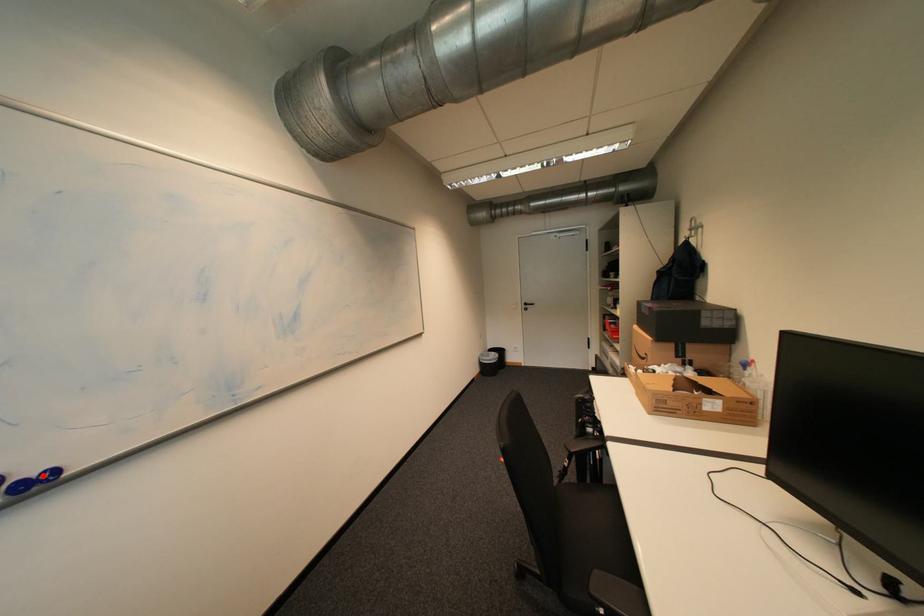
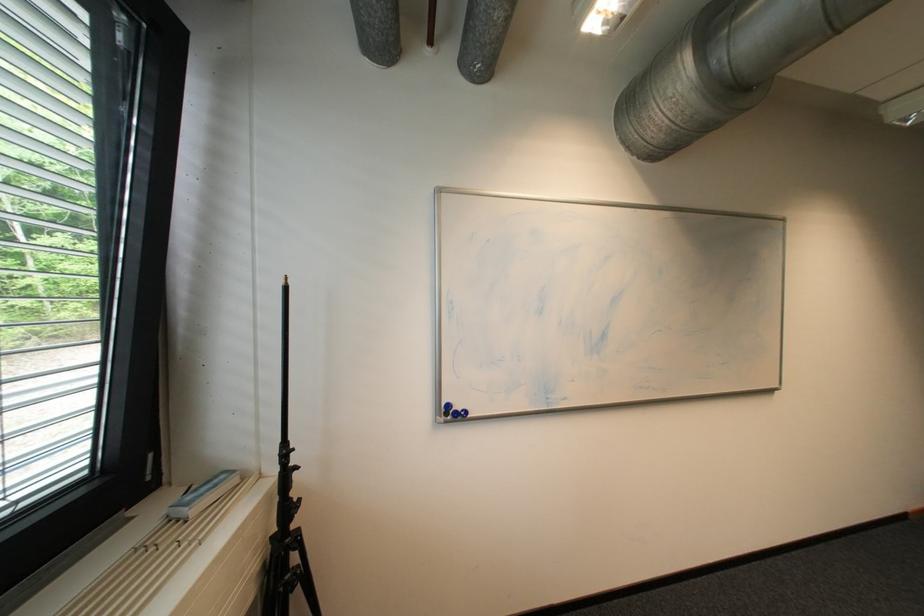
Locate, in the second image, the point that corresponds to the highlighted location in the first image.

(468, 410)